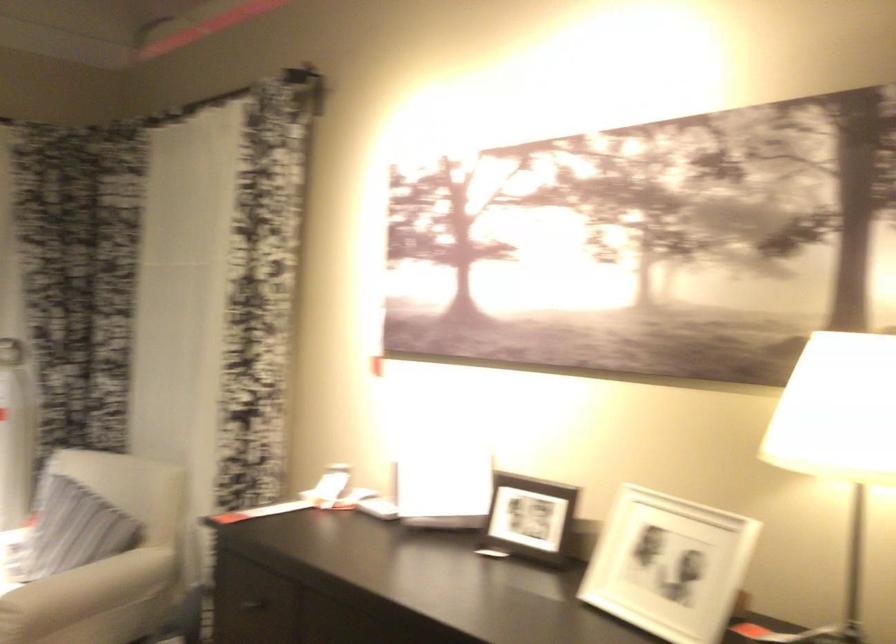
In order to click on white picture frame in this screenshot , I will do `click(668, 565)`.